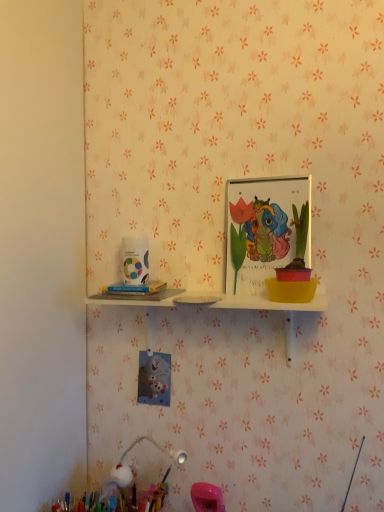
Question: Does white paper at left appear on the right side of pastel fluffy pom-pom at lower left?

Choices:
 (A) no
 (B) yes

Answer: (B)

Question: From the image's perspective, is white paper at left located beneath pastel fluffy pom-pom at lower left?

Choices:
 (A) no
 (B) yes

Answer: (A)

Question: From a real-world perspective, does white paper at left stand above pastel fluffy pom-pom at lower left?

Choices:
 (A) yes
 (B) no

Answer: (A)

Question: Is white paper at left not near pastel fluffy pom-pom at lower left?

Choices:
 (A) no
 (B) yes

Answer: (A)

Question: Is white paper at left oriented away from pastel fluffy pom-pom at lower left?

Choices:
 (A) yes
 (B) no

Answer: (B)

Question: Visually, is pastel fluffy pom-pom at lower left positioned to the left or to the right of white paper at left?

Choices:
 (A) right
 (B) left

Answer: (B)

Question: Considering the positions of pastel fluffy pom-pom at lower left and white paper at left in the image, is pastel fluffy pom-pom at lower left wider or thinner than white paper at left?

Choices:
 (A) thin
 (B) wide

Answer: (B)

Question: Does point (135, 499) appear closer or farther from the camera than point (152, 282)?

Choices:
 (A) farther
 (B) closer

Answer: (A)

Question: From a real-world perspective, is pastel fluffy pom-pom at lower left positioned above or below white paper at left?

Choices:
 (A) above
 (B) below

Answer: (B)

Question: From a real-world perspective, is white glossy plate at upper center above or below white paper at left?

Choices:
 (A) above
 (B) below

Answer: (B)

Question: Do you think white glossy plate at upper center is within white paper at left, or outside of it?

Choices:
 (A) inside
 (B) outside

Answer: (B)

Question: Relative to white paper at left, is white glossy plate at upper center in front or behind?

Choices:
 (A) behind
 (B) front

Answer: (B)

Question: Is white glossy plate at upper center taller or shorter than white paper at left?

Choices:
 (A) tall
 (B) short

Answer: (A)

Question: Is matte plastic picture frame at upper center situated inside pastel fluffy pom-pom at lower left or outside?

Choices:
 (A) outside
 (B) inside

Answer: (A)

Question: From the image's perspective, is matte plastic picture frame at upper center positioned above or below pastel fluffy pom-pom at lower left?

Choices:
 (A) above
 (B) below

Answer: (A)